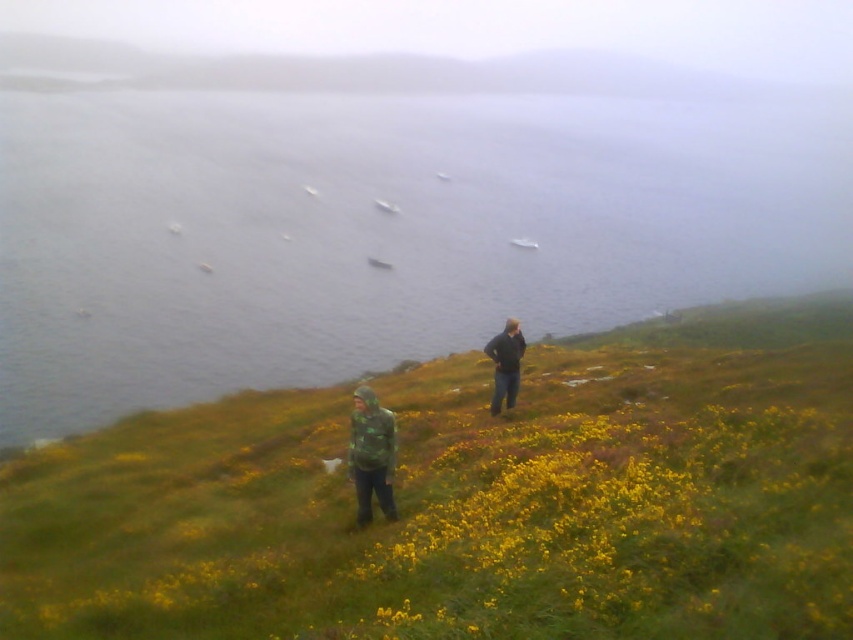
You are planning to take a photo of the gray water at center and the camouflage jacket at lower center. Which object should you focus on first if you want to capture both in the same frame without moving the camera?

You should focus on the camouflage jacket at lower center first because the gray water at center is wider and will require a wider angle to include both in the frame.

You are standing on the grassy hillside and want to take a photo of the gray water at center and the yellow matte flowers at center. Which object should you focus on first if you want both to be in sharp focus?

The gray water at center is taller than the yellow matte flowers at center, so you should focus on the gray water at center first to ensure both are in sharp focus.

You are standing at the base of the hill and want to pick a bouquet of yellow matte flowers at center. The path to them is straight but has a slope. If the slope is 15 degrees, how far will you have to walk horizontally to reach the flowers?

The yellow matte flowers at center are 41.27 feet apart from you. Using trigonometry, the horizontal distance would be 41.27 multiplied by the cosine of 15 degrees, which equals approximately 39.4 feet. Therefore, you need to walk about 39.4 feet horizontally to reach them.